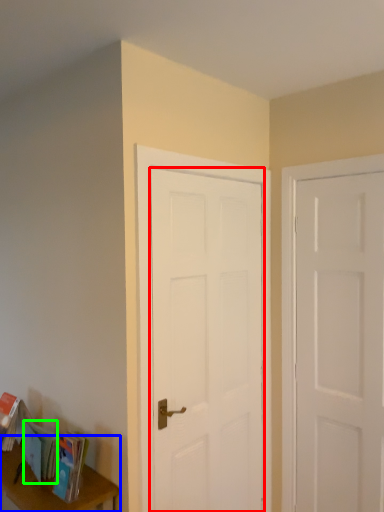
Question: Estimate the real-world distances between objects in this image. Which object is closer to door (highlighted by a red box), table (highlighted by a blue box) or book (highlighted by a green box)?

Choices:
 (A) table
 (B) book

Answer: (A)